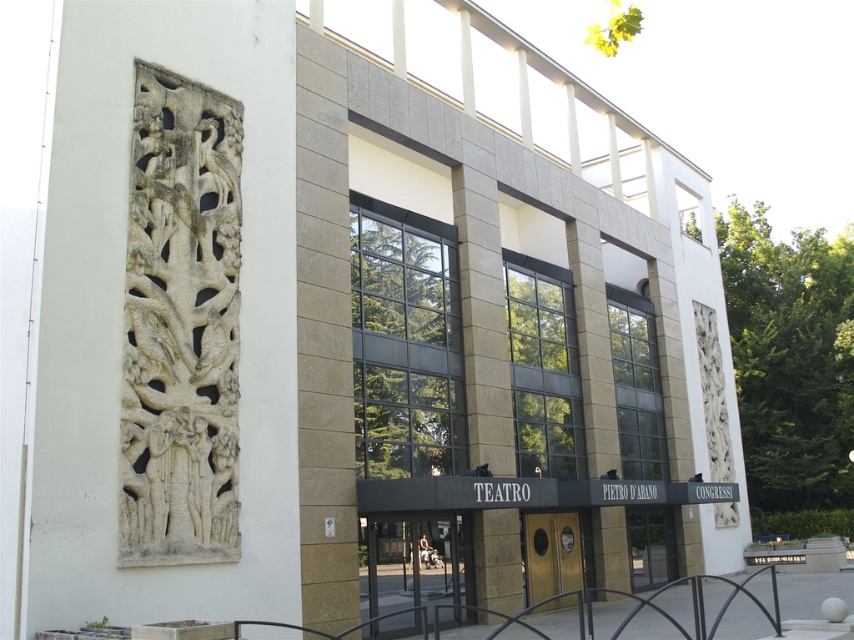
You are a visitor standing in front of the Teatro Pietro D Arano Congressi. You notice the white stone carving at left and the green leafy tree at right. Which object is taller?

The white stone carving at left is not as tall as the green leafy tree at right, so the green leafy tree at right is taller.

You are standing in front of the Teatro Pietro D Arano Congressi building and want to enter through the gold metallic door at center. There is a green leafy tree at center blocking your path. Can you walk around the tree to reach the door?

The green leafy tree at center has a larger width than the gold metallic door at center. Since the tree is wider, you can walk around it to reach the door.

Looking at this image, you are standing in front of the Teatro Pietro D Arano Congressi building and need to enter through the gold metallic door at center. There is a green leafy tree at center blocking your path. Can you walk through the tree to reach the door?

The green leafy tree at center is taller than gold metallic door at center, so the tree may block your path. You cannot walk through the tree to reach the door.